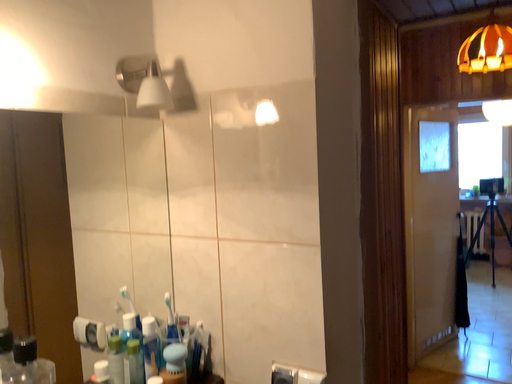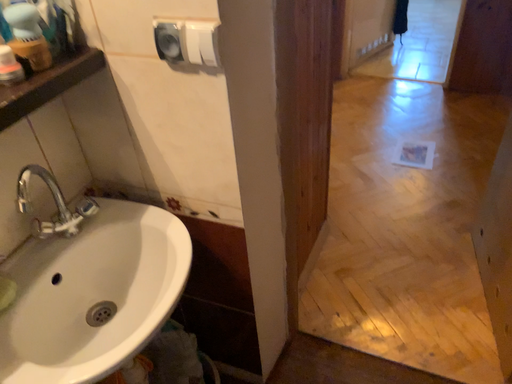
Question: How did the camera likely rotate when shooting the video?

Choices:
 (A) rotated left
 (B) rotated right

Answer: (B)